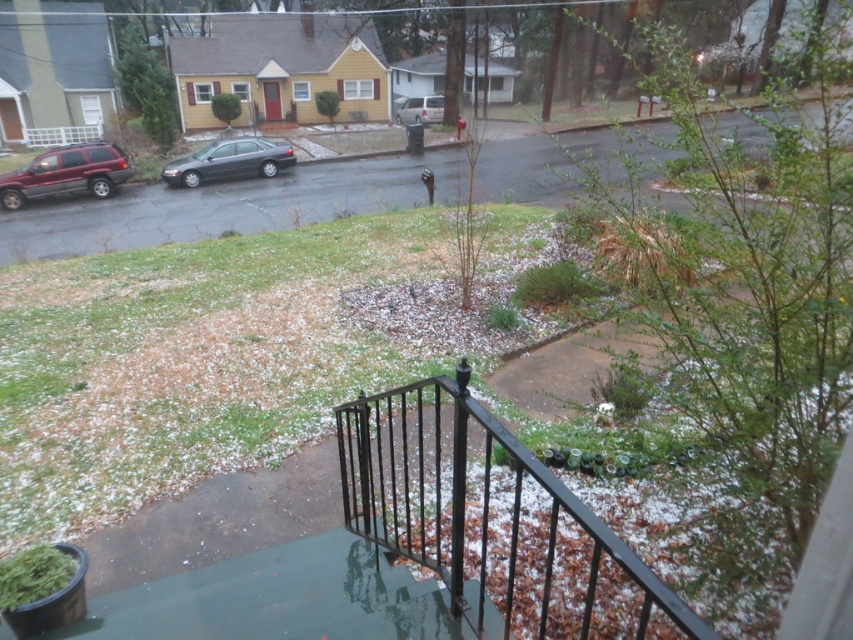
You are standing on the dark green steps leading down to the grassy area. You see two points marked in the scene. Which point is closer to you, point (187, 160) or point (407, 113)?

Point (187, 160) is closer to you because it is in front of point (407, 113).